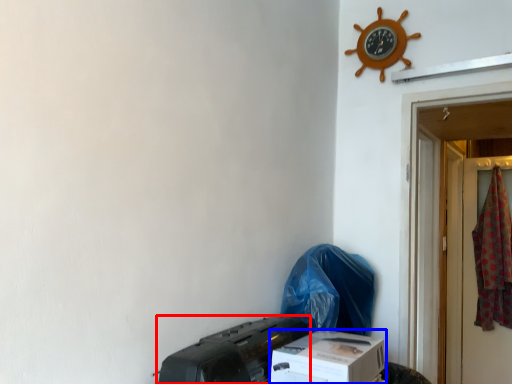
Question: Among these objects, which one is farthest to the camera, printer (highlighted by a red box) or box (highlighted by a blue box)?

Choices:
 (A) printer
 (B) box

Answer: (B)